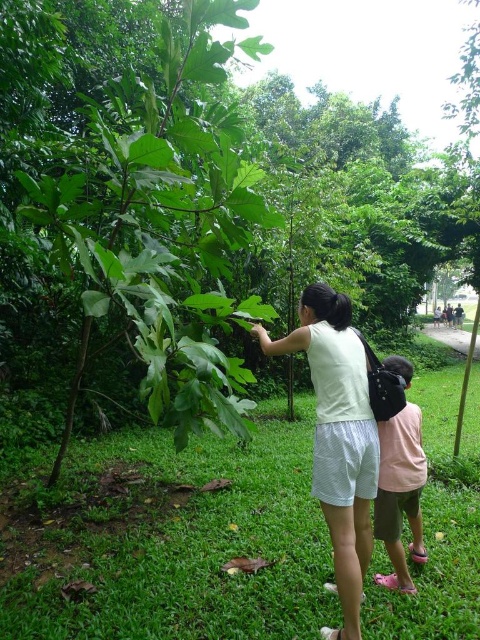
You are planning to place a small garden statue that requires a 20 cm wide base. Based on the scene, which object between the green grass at lower center and the white cotton shirt at center would be suitable to place it on?

The green grass at lower center might be wider than the white cotton shirt at center, so the statue can be placed on the green grass at lower center as it has sufficient width.